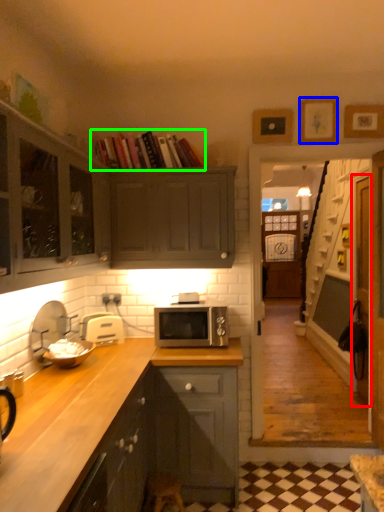
Question: Which is nearer to the glass door (highlighted by a red box)? picture frame (highlighted by a blue box) or book (highlighted by a green box).

Choices:
 (A) picture frame
 (B) book

Answer: (A)